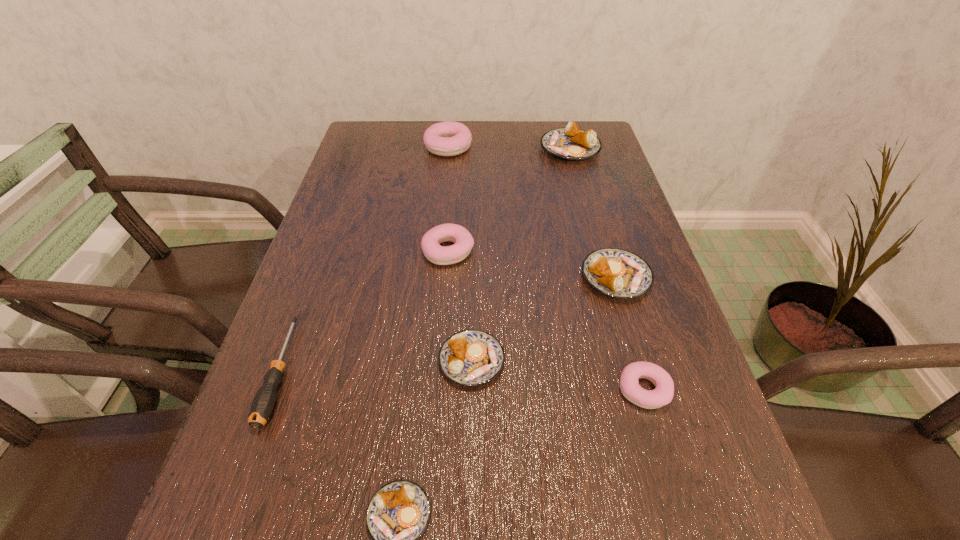
Where is `brown pastry that stands as the third closest to the second farthest brown pastry`? This screenshot has width=960, height=540. brown pastry that stands as the third closest to the second farthest brown pastry is located at coordinates (398, 513).

In order to click on the second closest brown pastry to the nearest pink pastry in this screenshot , I will do `click(470, 357)`.

Select which pink pastry appears as the second closest to the farthest pink pastry. Please provide its 2D coordinates. Your answer should be formatted as a tuple, i.e. [(x, y)], where the tuple contains the x and y coordinates of a point satisfying the conditions above.

[(662, 395)]

Find the location of a particular element. pink pastry identified as the closest to the farthest brown pastry is located at coordinates (448, 138).

The width and height of the screenshot is (960, 540). What are the coordinates of `vacant space that satisfies the following two spatial constraints: 1. on the front side of the second biggest brown pastry; 2. on the right side of the farthest pink pastry` in the screenshot? It's located at (436, 278).

Locate an element on the screen. Image resolution: width=960 pixels, height=540 pixels. vacant position in the image that satisfies the following two spatial constraints: 1. on the front side of the rightmost pink pastry; 2. on the left side of the farthest pink pastry is located at coordinates (424, 389).

Locate an element on the screen. The image size is (960, 540). vacant region that satisfies the following two spatial constraints: 1. on the back side of the biggest brown pastry; 2. on the left side of the second farthest pink pastry is located at coordinates (456, 149).

You are a GUI agent. You are given a task and a screenshot of the screen. Output one action in this format:
    pyautogui.click(x=<x>, y=<y>)
    Task: Click on the vacant area in the image that satisfies the following two spatial constraints: 1. on the back side of the nearest pink pastry; 2. on the left side of the third nearest brown pastry
    
    Given the screenshot: What is the action you would take?
    pyautogui.click(x=612, y=278)